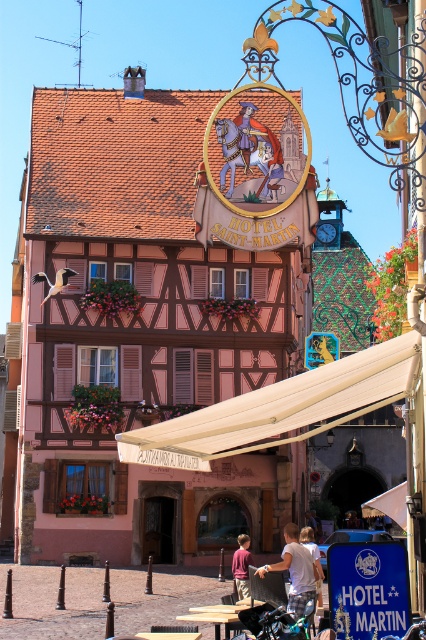
Question: Does beige fabric canopy at center appear on the right side of white cotton shirt at lower center?

Choices:
 (A) no
 (B) yes

Answer: (A)

Question: Can you confirm if beige fabric canopy at center is thinner than maroon shirt at center?

Choices:
 (A) no
 (B) yes

Answer: (A)

Question: Which object appears closest to the camera in this image?

Choices:
 (A) white cotton shirt at center
 (B) beige fabric canopy at center
 (C) white cotton shirt at lower center
 (D) maroon shirt at center

Answer: (B)

Question: Which of the following is the farthest from the observer?

Choices:
 (A) beige fabric canopy at center
 (B) white cotton shirt at center
 (C) white cotton shirt at lower center
 (D) maroon shirt at center

Answer: (D)

Question: Can you confirm if beige fabric canopy at center is smaller than maroon shirt at center?

Choices:
 (A) no
 (B) yes

Answer: (A)

Question: Which point appears closest to the camera in this image?

Choices:
 (A) (294, 548)
 (B) (247, 579)
 (C) (308, 534)
 (D) (235, 419)

Answer: (D)